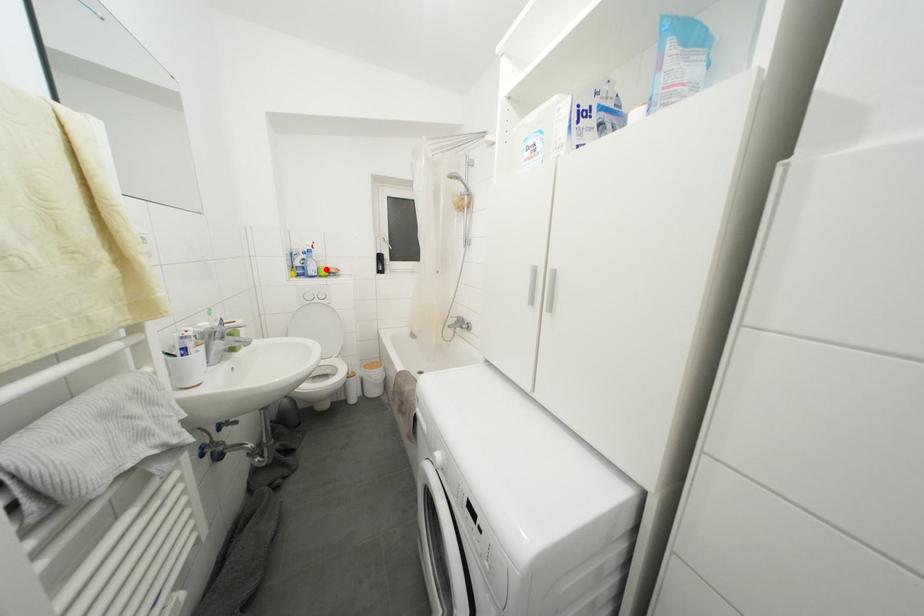
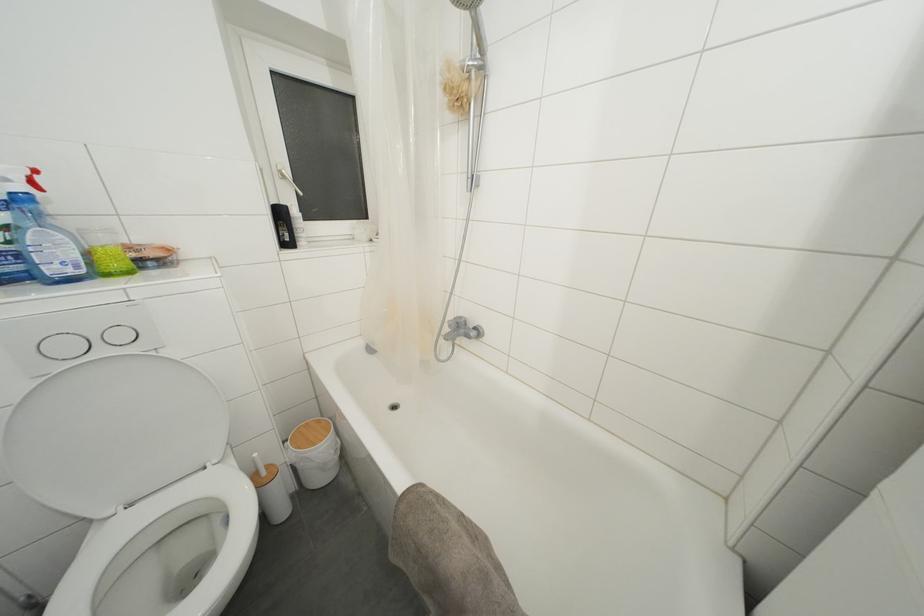
Where in the second image is the point corresponding to the highlighted location from the first image?

(108, 245)